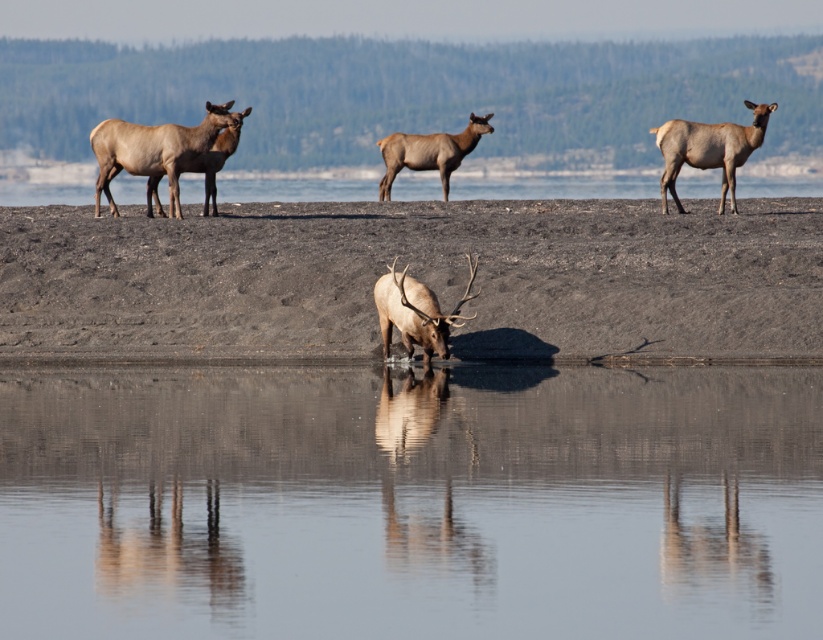
You are an ecologist studying the water and soil in this area. You notice the clear water at center and the dull brown dirt at center. Which of these two has a smaller width in the scene?

The clear water at center is thinner than the dull brown dirt at center, so the clear water at center has a smaller width.

You are an environmental scientist studying the elk habitat. You observe the dull brown dirt at center and the brown velvet deer at upper right in the scene. Which object is positioned to the left of the other?

The dull brown dirt at center is to the left of brown velvet deer at upper right.

You are an environmental scientist analyzing the image. You need to determine the elevation difference between the clear water at center and the dull brown dirt at center. Based on their positions, which one is higher in elevation?

The clear water at center is located below the dull brown dirt at center, so the dull brown dirt at center is higher in elevation than the clear water at center.